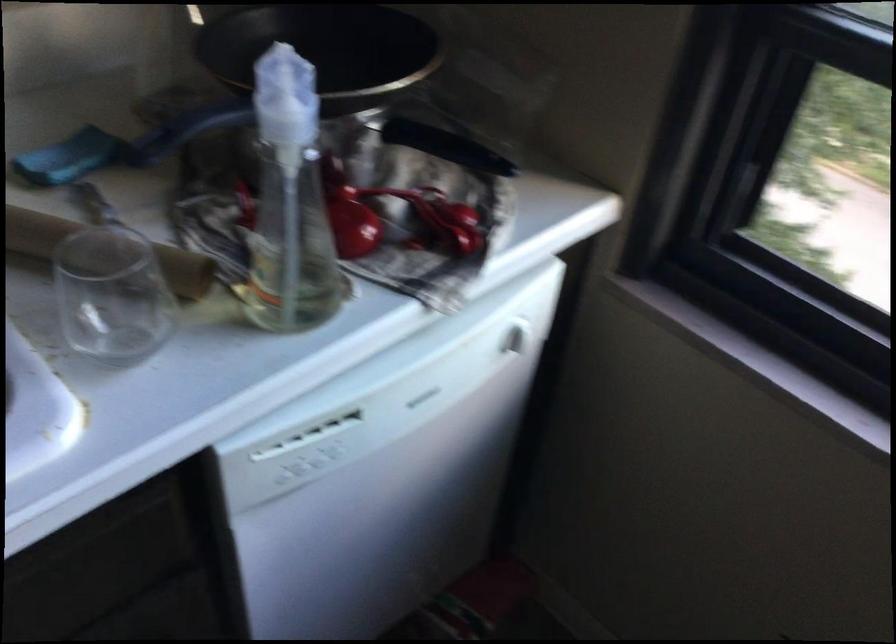
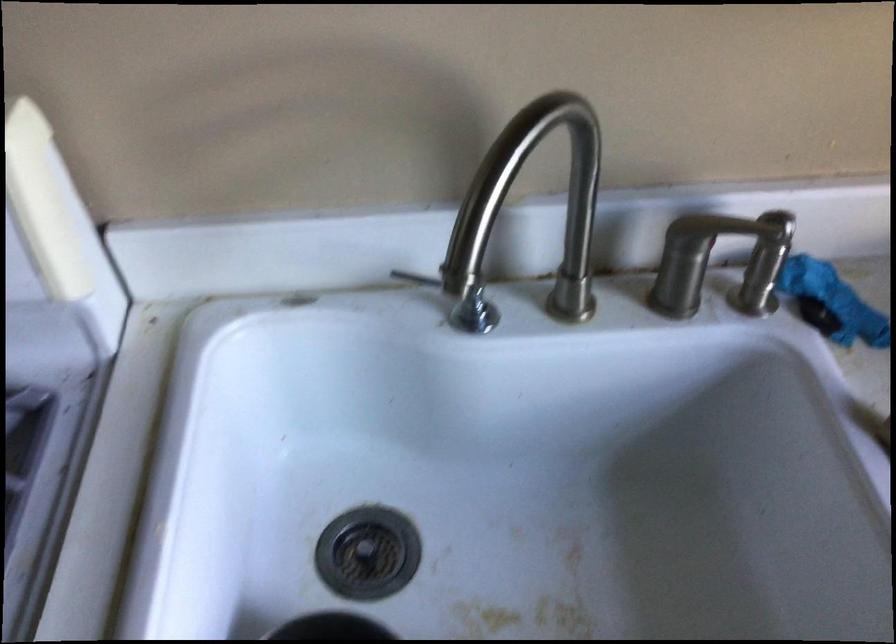
Question: Based on the continuous images, in which direction is the camera rotating? Reply with the corresponding letter.

Choices:
 (A) Left
 (B) Right
 (C) Up
 (D) Down

Answer: (A)